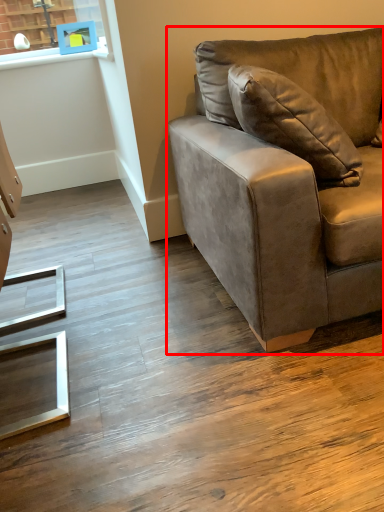
Question: Considering the relative positions of studio couch (annotated by the red box) and picture frame in the image provided, where is studio couch (annotated by the red box) located with respect to the staircase?

Choices:
 (A) right
 (B) left

Answer: (A)